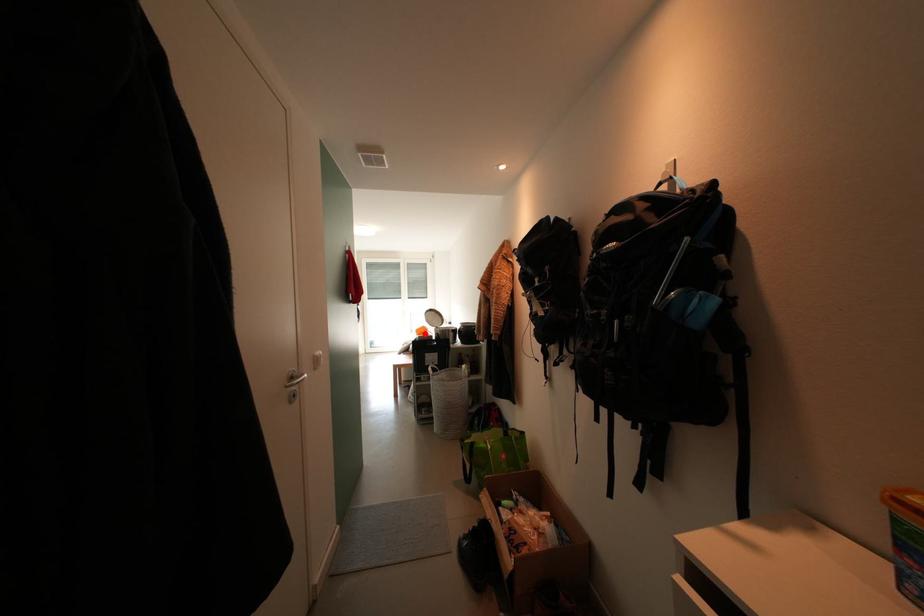
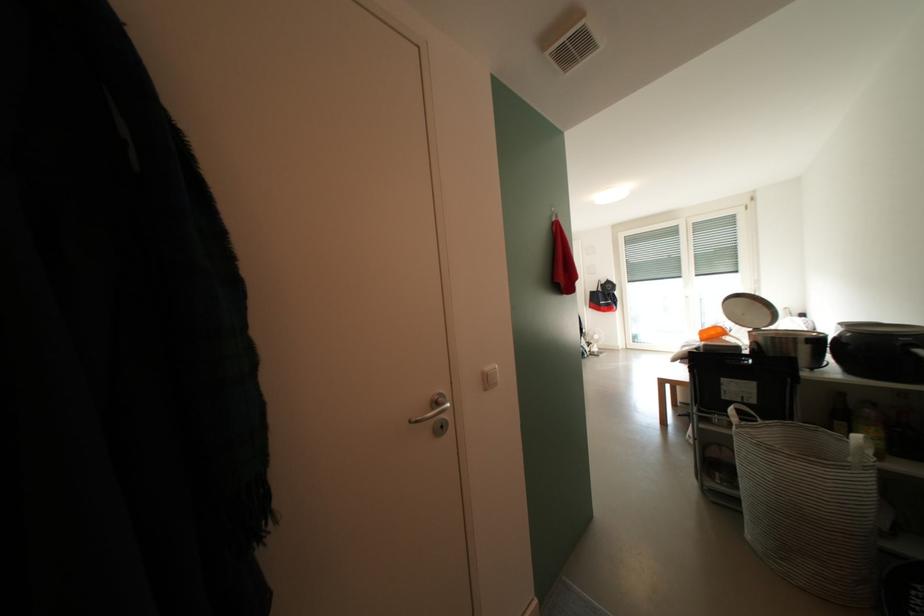
Locate, in the second image, the point that corresponds to the highlighted location in the first image.

(710, 336)